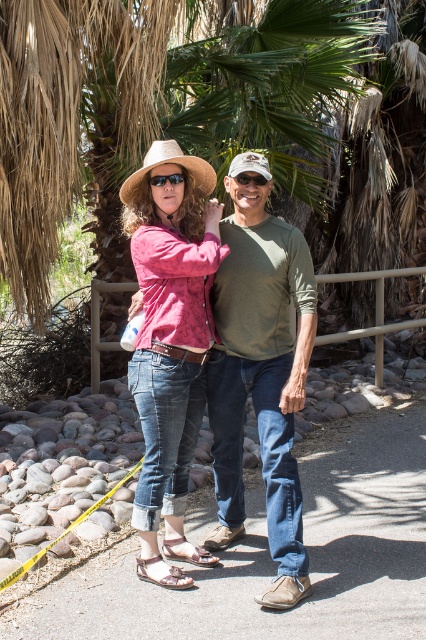
Between leather textured sandal at lower left and brown leather sandal at lower center, which one appears on the right side from the viewer's perspective?

From the viewer's perspective, brown leather sandal at lower center appears more on the right side.

Which is more to the left, leather textured sandal at lower left or brown leather sandal at lower center?

Positioned to the left is leather textured sandal at lower left.

Image resolution: width=426 pixels, height=640 pixels. I want to click on leather textured sandal at lower left, so click(163, 577).

Can you confirm if straw hat at center is bigger than brown leather sandal at lower center?

Yes, straw hat at center is bigger than brown leather sandal at lower center.

Does point (137, 180) lie in front of point (172, 548)?

That is True.

Which is behind, point (135, 192) or point (169, 544)?

Point (169, 544)

Where is `straw hat at center`? The width and height of the screenshot is (426, 640). straw hat at center is located at coordinates (170, 163).

Between matte pink shirt at center and black matte goggles at center, which one appears on the right side from the viewer's perspective?

black matte goggles at center

Is point (166, 182) farther from camera compared to point (253, 179)?

No, (166, 182) is closer to viewer.

In order to click on matte pink shirt at center in this screenshot , I will do `click(169, 324)`.